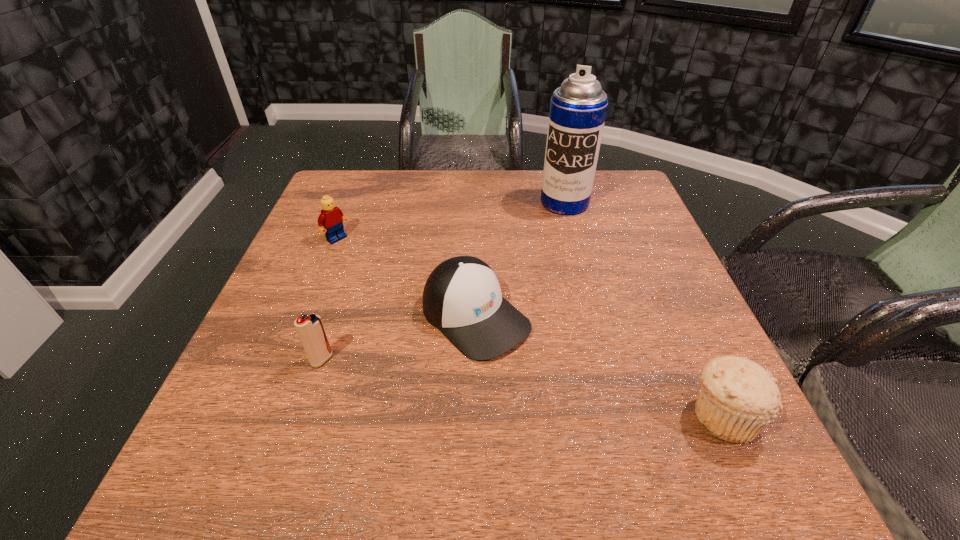
The height and width of the screenshot is (540, 960). I want to click on free spot located on the label side of the farthest object, so click(547, 244).

Find the location of a particular element. vacant space located 0.090m on the label side of the farthest object is located at coordinates (551, 234).

Image resolution: width=960 pixels, height=540 pixels. Find the location of `free space located on the label side of the farthest object`. free space located on the label side of the farthest object is located at coordinates (552, 232).

Find the location of `free space located 0.100m on the front-facing side of the second farthest object`. free space located 0.100m on the front-facing side of the second farthest object is located at coordinates (368, 262).

Where is `vacant space located 0.080m on the front-facing side of the second farthest object`? Image resolution: width=960 pixels, height=540 pixels. vacant space located 0.080m on the front-facing side of the second farthest object is located at coordinates (363, 258).

You are a GUI agent. You are given a task and a screenshot of the screen. Output one action in this format:
    pyautogui.click(x=<x>, y=<y>)
    Task: Click on the vacant point located 0.350m on the front-facing side of the second farthest object
    The height and width of the screenshot is (540, 960).
    Given the screenshot: What is the action you would take?
    pyautogui.click(x=441, y=316)

The width and height of the screenshot is (960, 540). What are the coordinates of `vacant region located 0.150m on the front panel of the cap` in the screenshot? It's located at (574, 405).

At what (x,y) coordinates should I click in order to perform the action: click on vacant point located 0.050m on the front panel of the cap. Please return your answer as a coordinate pair (x, y). Looking at the image, I should click on (532, 368).

Image resolution: width=960 pixels, height=540 pixels. Identify the location of vacant space located 0.050m on the front panel of the cap. click(x=532, y=368).

At what (x,y) coordinates should I click in order to perform the action: click on object that is at the far edge. Please return your answer as a coordinate pair (x, y). Looking at the image, I should click on (578, 108).